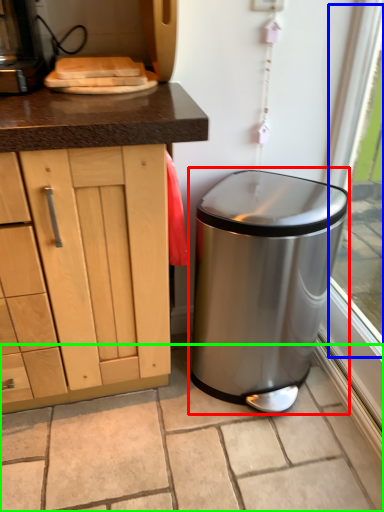
Question: Based on their relative distances, which object is nearer to waste container (highlighted by a red box)? Choose from window screen (highlighted by a blue box) and granite (highlighted by a green box).

Choices:
 (A) window screen
 (B) granite

Answer: (B)